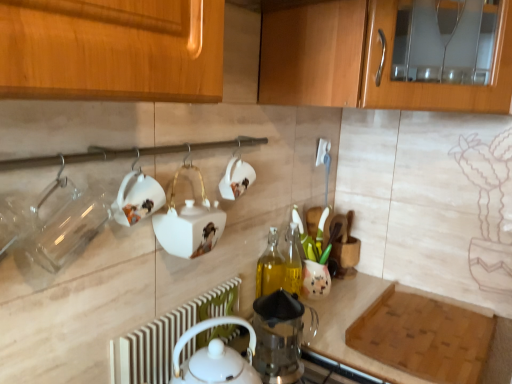
Question: Considering the relative positions of wooden cabinet at upper right and translucent glass bottle at center in the image provided, is wooden cabinet at upper right to the right of translucent glass bottle at center from the viewer's perspective?

Choices:
 (A) yes
 (B) no

Answer: (A)

Question: Can you confirm if wooden cabinet at upper right is shorter than translucent glass bottle at center?

Choices:
 (A) no
 (B) yes

Answer: (A)

Question: Can you confirm if wooden cabinet at upper right is wider than translucent glass bottle at center?

Choices:
 (A) no
 (B) yes

Answer: (B)

Question: From a real-world perspective, is wooden cabinet at upper right positioned under translucent glass bottle at center based on gravity?

Choices:
 (A) no
 (B) yes

Answer: (A)

Question: Can we say wooden cabinet at upper right lies outside translucent glass bottle at center?

Choices:
 (A) yes
 (B) no

Answer: (A)

Question: Could you tell me if wooden cabinet at upper right is facing translucent glass bottle at center?

Choices:
 (A) no
 (B) yes

Answer: (A)

Question: Is white glossy teapot at lower center, which ranks as the second tea set in right-to-left order, surrounding transparent glass coffee press at center, which is the first appliance in right-to-left order?

Choices:
 (A) yes
 (B) no

Answer: (B)

Question: Can you confirm if white glossy teapot at lower center, positioned as the first tea set in left-to-right order, is taller than transparent glass coffee press at center, the second appliance viewed from the left?

Choices:
 (A) no
 (B) yes

Answer: (B)

Question: Is white glossy teapot at lower center, arranged as the second tea set when viewed from the back, facing towards transparent glass coffee press at center, placed as the 2th appliance when sorted from top to bottom?

Choices:
 (A) yes
 (B) no

Answer: (B)

Question: From a real-world perspective, does white glossy teapot at lower center, which ranks as the second tea set in right-to-left order, sit lower than transparent glass coffee press at center, the 1th appliance in the bottom-to-top sequence?

Choices:
 (A) yes
 (B) no

Answer: (B)

Question: Is white glossy teapot at lower center, positioned as the first tea set in left-to-right order, turned away from transparent glass coffee press at center, the second appliance viewed from the left?

Choices:
 (A) no
 (B) yes

Answer: (A)

Question: From the image's perspective, does white glossy teapot at lower center, arranged as the second tea set when viewed from the back, appear lower than transparent glass coffee press at center, which is the first appliance in right-to-left order?

Choices:
 (A) no
 (B) yes

Answer: (B)

Question: Does transparent glass jar at left, the 1th tableware positioned from the left, have a greater width compared to wooden cabinet at upper right?

Choices:
 (A) yes
 (B) no

Answer: (B)